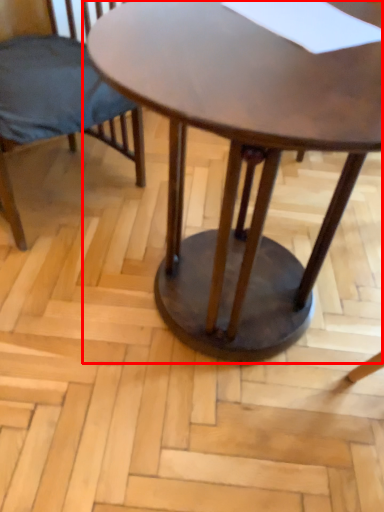
Question: Observing the image, what is the correct spatial positioning of coffee table (annotated by the red box) in reference to chair?

Choices:
 (A) right
 (B) left

Answer: (A)